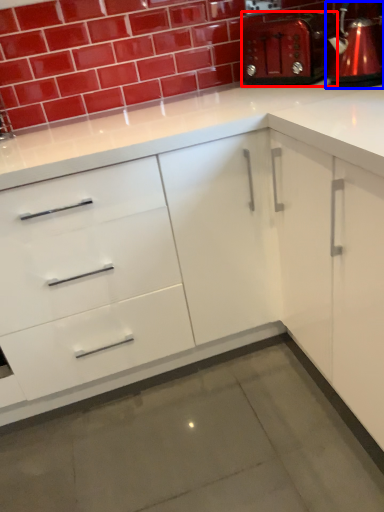
Question: Which point is closer to the camera, appliance (highlighted by a red box) or coffeepot (highlighted by a blue box)?

Choices:
 (A) appliance
 (B) coffeepot

Answer: (B)